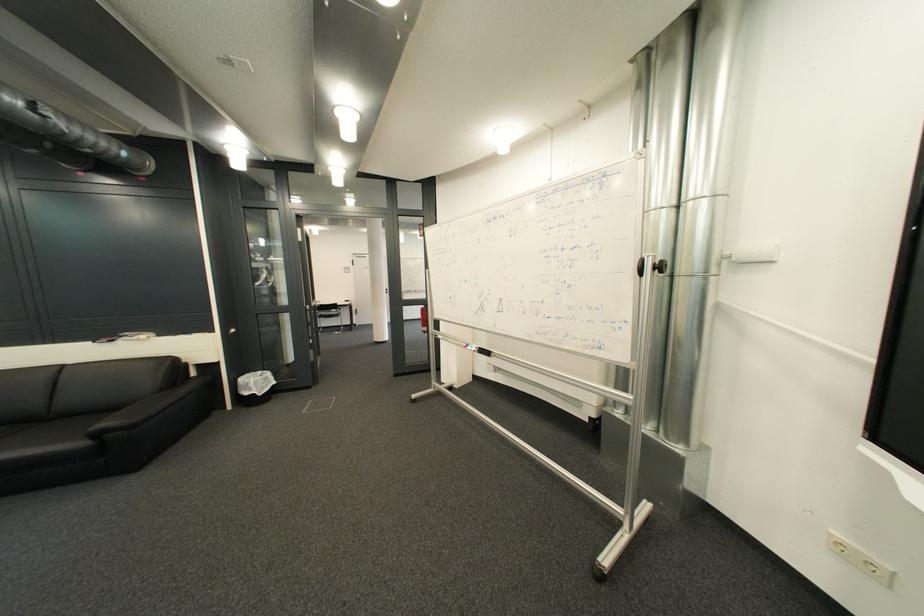
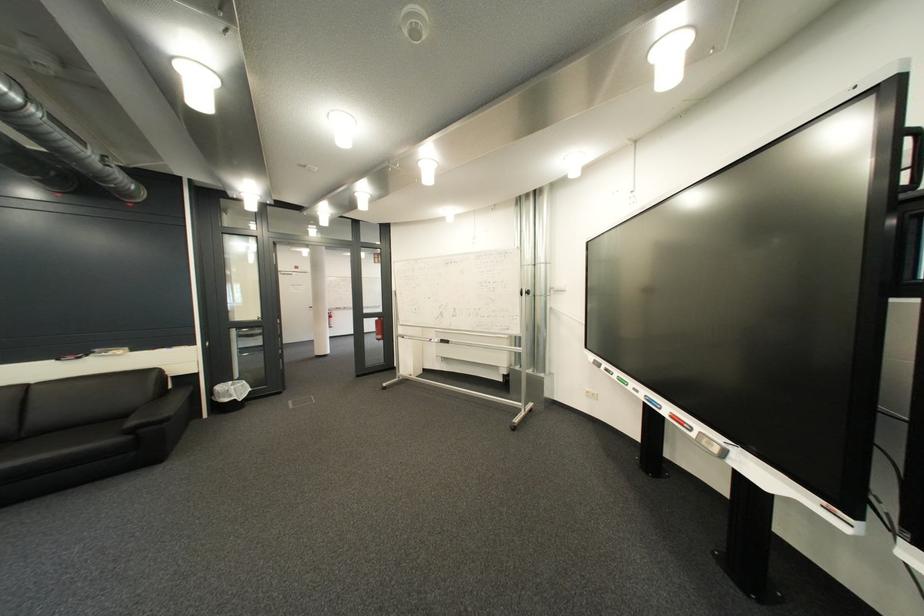
The images are taken continuously from a first-person perspective. In which direction are you moving?

The movement direction of the cameraman is left, backward.